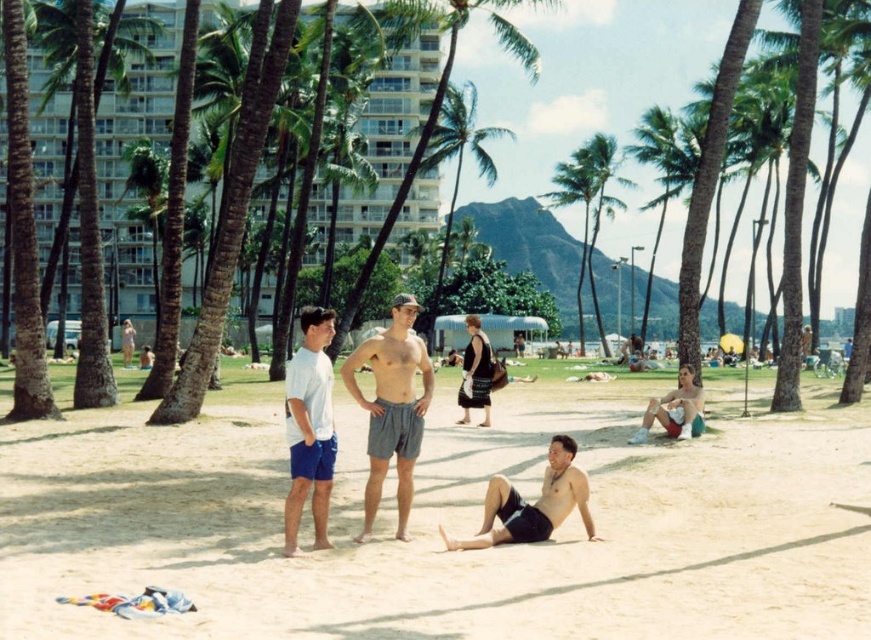
You are a photographer trying to capture the white cotton t shirt at center in the beach scene. The camera is positioned at the point with coordinates (x=309, y=428). Can you confirm if this coordinate points to the correct location of the white cotton t shirt at center?

Yes, the point at coordinates (x=309, y=428) does indicate the white cotton t shirt at center as stated in the objects description.